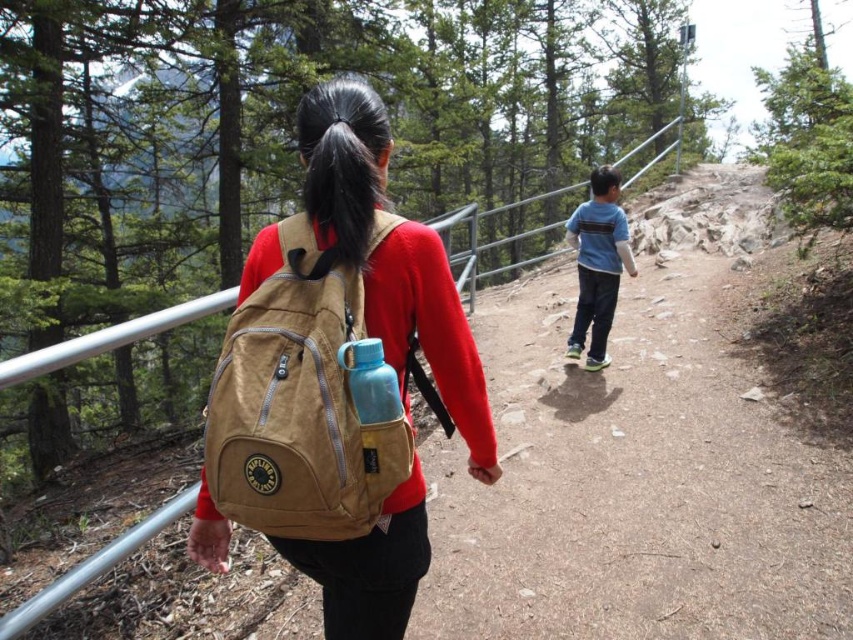
You are a hiker who wants to compare the sizes of the two items in the scene. Which object is wider, the tan canvas backpack at back or the blue cotton shirt at center?

The tan canvas backpack at back is wider than the blue cotton shirt at center.

You are a hiker who just arrived at the trailhead and see the black hair at upper center and the blue cotton shirt at center. Which hiker is closer to the trailhead?

The black hair at upper center is to the left of the blue cotton shirt at center. Since the blue cotton shirt at center is further along the trail, the black hair at upper center is closer to the trailhead.

You are a photographer trying to capture both the black hair at upper center and the blue cotton shirt at center in a single shot. Which object should you focus on first to ensure both are in frame?

The black hair at upper center is thinner than the blue cotton shirt at center, so you should focus on the blue cotton shirt at center first to ensure both are in frame.